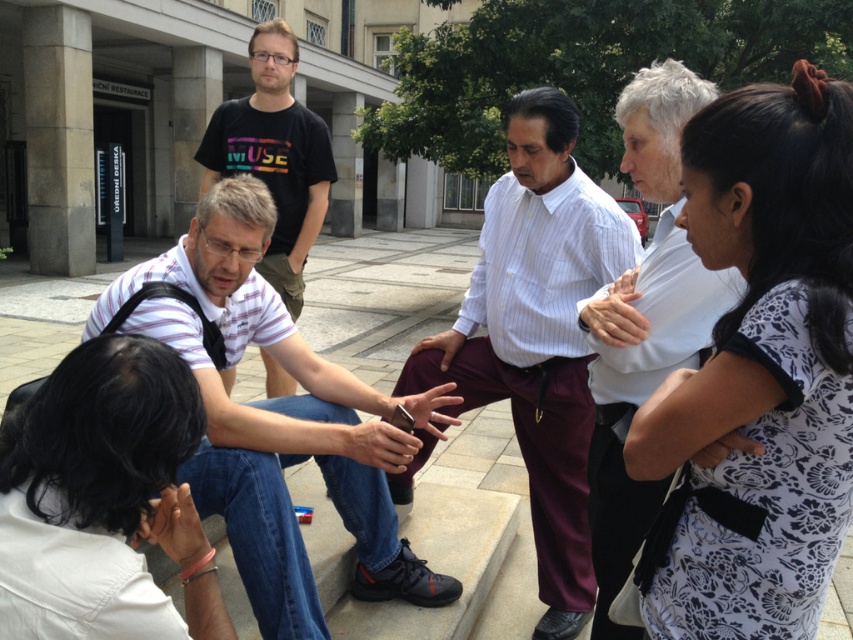
Question: Is white striped shirt at center closer to camera compared to metallic ring at center?

Choices:
 (A) yes
 (B) no

Answer: (B)

Question: Which of these objects is positioned closest to the white striped shirt at center?

Choices:
 (A) white striped polo shirt at center
 (B) white shirt at upper center
 (C) brown leather hand at center
 (D) white floral dress at upper right

Answer: (B)

Question: Which of these objects is positioned closest to the white fabric at lower left?

Choices:
 (A) white striped polo shirt at center
 (B) dark skin hand at lower left
 (C) white floral dress at upper right

Answer: (B)

Question: Can you confirm if dark skin hand at lower left is positioned to the right of brown leather hand at center?

Choices:
 (A) yes
 (B) no

Answer: (B)

Question: Which of the following is the farthest from the observer?

Choices:
 (A) matte black t-shirt at center
 (B) white fabric at lower left

Answer: (A)

Question: Is white floral dress at upper right to the right of white fabric at lower left from the viewer's perspective?

Choices:
 (A) no
 (B) yes

Answer: (B)